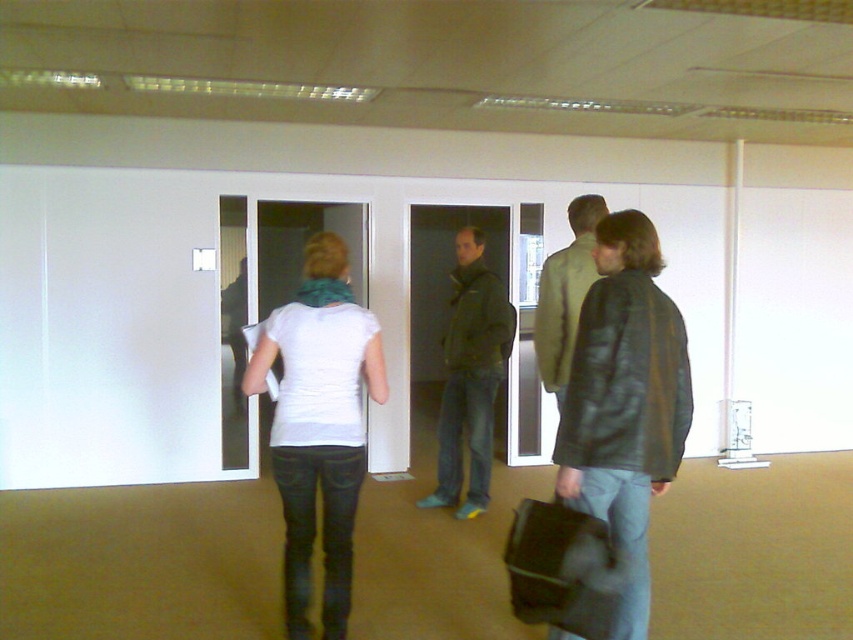
Question: Can you confirm if leather jacket at right is positioned to the left of white matte shirt at center?

Choices:
 (A) no
 (B) yes

Answer: (A)

Question: Which object is the farthest from the leather jacket at right?

Choices:
 (A) dark green jacket at center
 (B) white matte shirt at center
 (C) light brown leather jacket at center

Answer: (A)

Question: Is leather jacket at right thinner than white matte shirt at center?

Choices:
 (A) no
 (B) yes

Answer: (B)

Question: Can you confirm if dark green jacket at center is bigger than light brown leather jacket at center?

Choices:
 (A) no
 (B) yes

Answer: (B)

Question: Which point is closer to the camera?

Choices:
 (A) (468, 292)
 (B) (268, 358)
 (C) (645, 301)

Answer: (C)

Question: Which object is closer to the camera taking this photo?

Choices:
 (A) dark green jacket at center
 (B) light brown leather jacket at center
 (C) leather jacket at right
 (D) white matte shirt at center

Answer: (C)